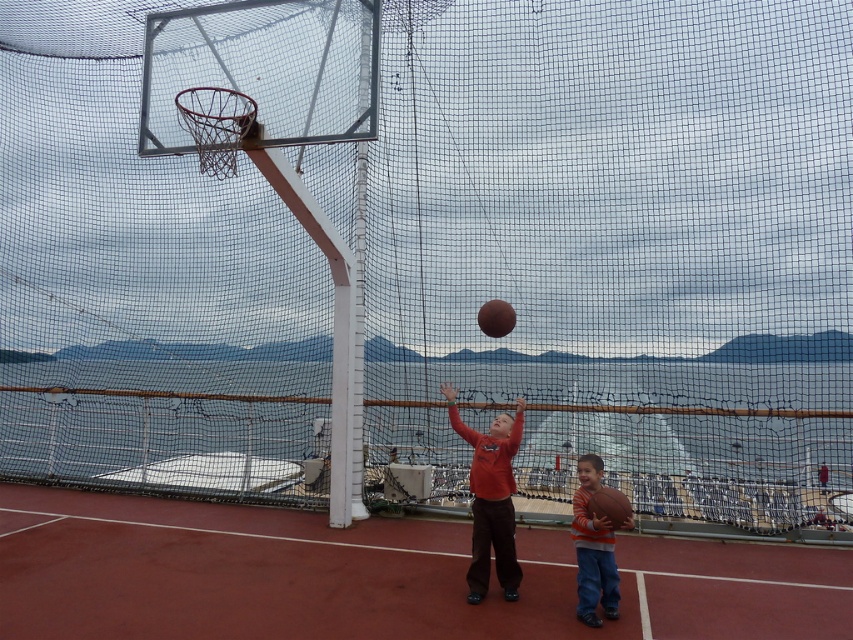
What is the coordinate of the rubberized red basketball court at center?

The rubberized red basketball court at center is located at coordinate point (x=372, y=577).